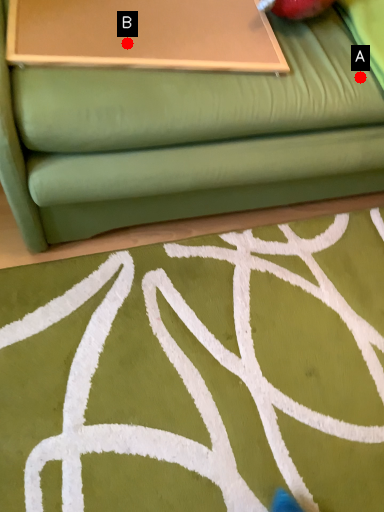
Question: Two points are circled on the image, labeled by A and B beside each circle. Which point is closer to the camera?

Choices:
 (A) A is closer
 (B) B is closer

Answer: (B)